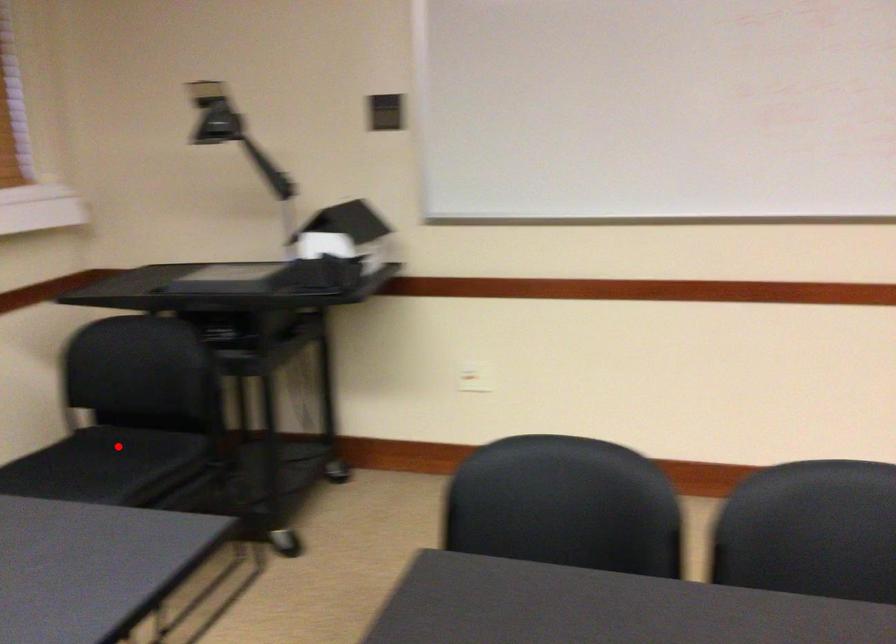
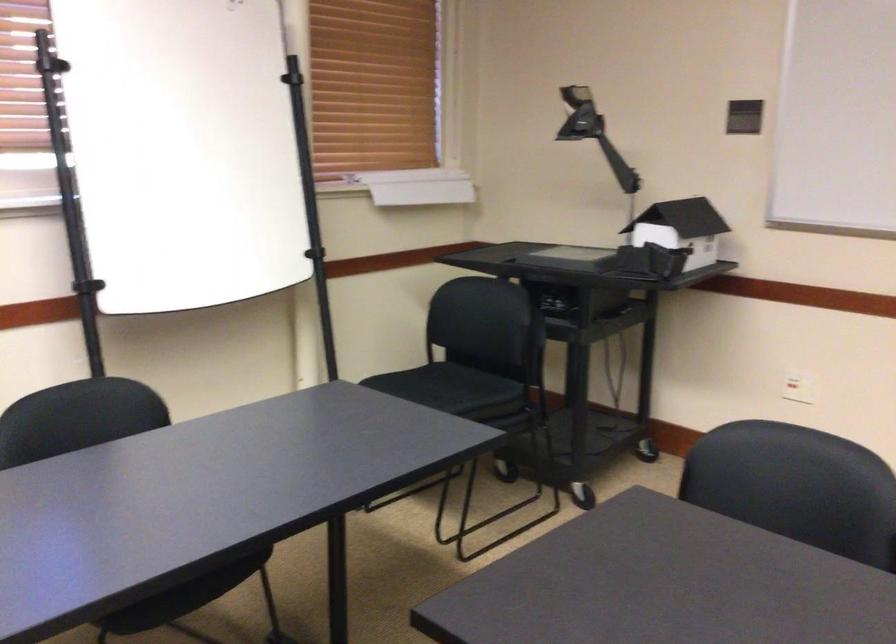
Question: I am providing you with two images of the same scene from different viewpoints. In image1, a red point is highlighted. Considering the same 3D point in image2, which of the following is correct?

Choices:
 (A) It is closer
 (B) It is farther

Answer: (B)